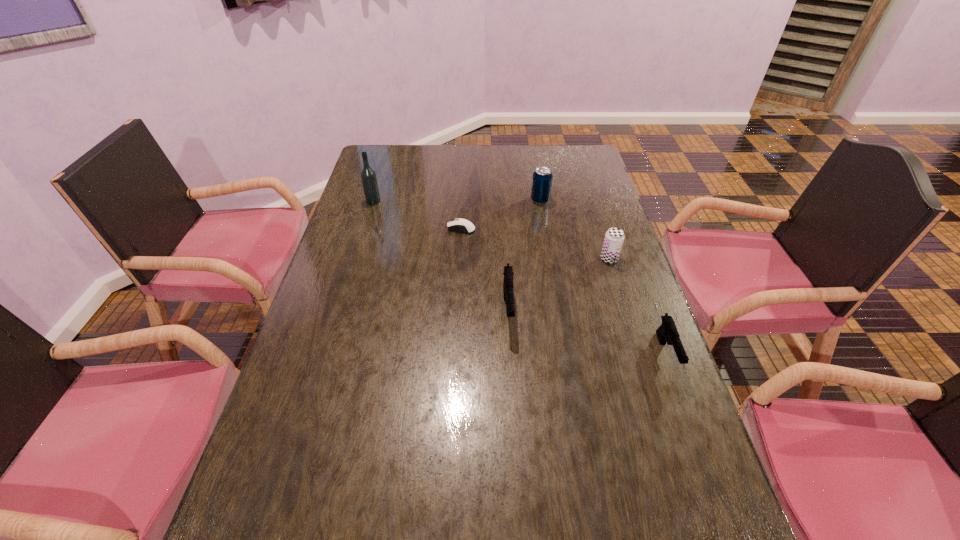
This screenshot has height=540, width=960. Find the location of `the leftmost object`. the leftmost object is located at coordinates (368, 176).

I want to click on free space located 0.110m on the front-facing side of the third object from left to right, so click(x=512, y=375).

Identify the location of vacant point located on the front-facing side of the second shortest object. This screenshot has height=540, width=960. (709, 471).

You are a GUI agent. You are given a task and a screenshot of the screen. Output one action in this format:
    pyautogui.click(x=<x>, y=<y>)
    Task: Click on the vacant space situated on the front of the beer can
    
    Given the screenshot: What is the action you would take?
    pyautogui.click(x=632, y=330)

I want to click on blank space located 0.320m on the front of the fourth object from left to right, so click(x=552, y=268).

What are the coordinates of `vacant space located on the right of the mouse` in the screenshot? It's located at (558, 228).

Find the location of a particular element. This screenshot has width=960, height=540. free space located on the back of the leftmost object is located at coordinates (383, 168).

Find the location of `object located in the left edge section of the desktop`. object located in the left edge section of the desktop is located at coordinates (368, 176).

This screenshot has height=540, width=960. Identify the location of pistol located in the right edge section of the desktop. (667, 332).

This screenshot has width=960, height=540. Identify the location of beer can positioned at the right edge. (614, 237).